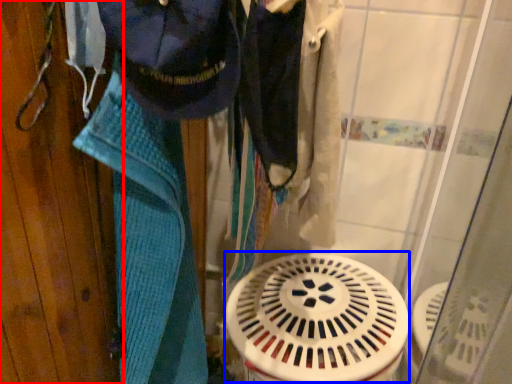
Question: Which of the following is the closest to the observer, door (highlighted by a red box) or water heater (highlighted by a blue box)?

Choices:
 (A) door
 (B) water heater

Answer: (A)